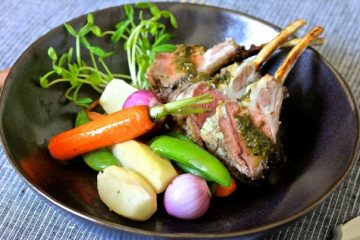
Locate an element on the screen. dark bowl is located at coordinates (39, 106).